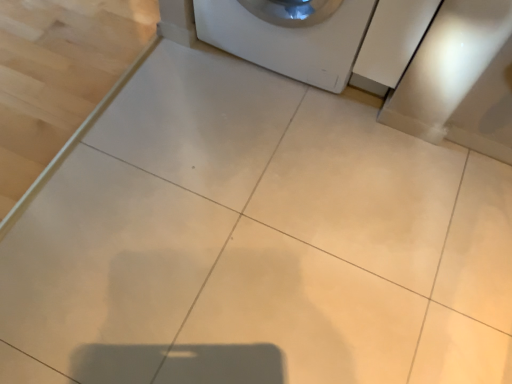
What are the coordinates of `white glossy washing machine at upper center` in the screenshot? It's located at (289, 35).

This screenshot has width=512, height=384. Describe the element at coordinates (289, 35) in the screenshot. I see `white glossy washing machine at upper center` at that location.

Where is `white glossy washing machine at upper center`? white glossy washing machine at upper center is located at coordinates (289, 35).